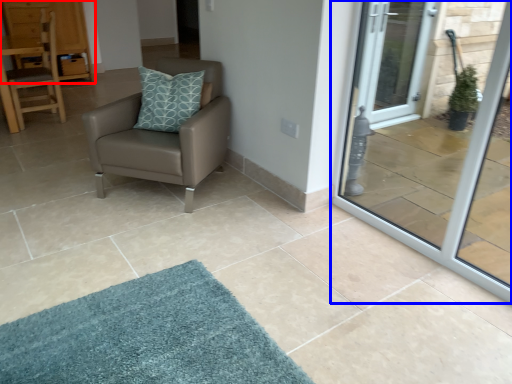
Question: Among these objects, which one is nearest to the camera, dresser (highlighted by a red box) or door (highlighted by a blue box)?

Choices:
 (A) dresser
 (B) door

Answer: (B)